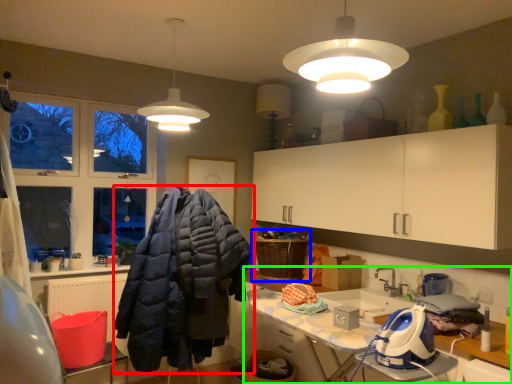
Question: Which object is positioned farthest from jacket (highlighted by a red box)? Select from laundry basket (highlighted by a blue box) and countertop (highlighted by a green box).

Choices:
 (A) laundry basket
 (B) countertop

Answer: (B)